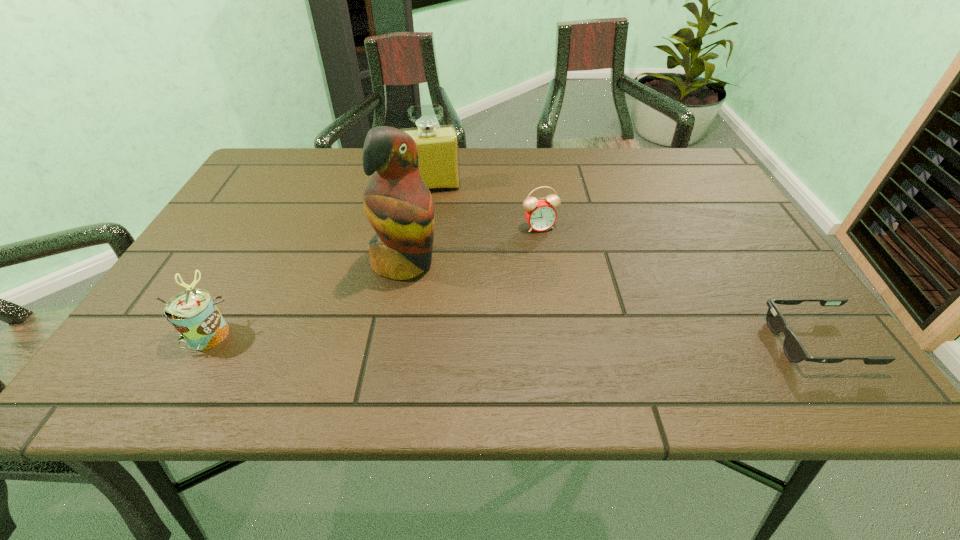
In order to click on free space on the desktop that is between the can and the rightmost object and is positioned on the front-facing side of the second tallest object in this screenshot , I will do `click(463, 337)`.

Locate an element on the screen. The width and height of the screenshot is (960, 540). free spot on the desktop that is between the can and the rightmost object and is positioned on the face of the tallest object is located at coordinates (515, 338).

Where is `free space on the desktop that is between the can and the rightmost object and is positioned on the clock face of the alarm clock`? This screenshot has height=540, width=960. free space on the desktop that is between the can and the rightmost object and is positioned on the clock face of the alarm clock is located at coordinates (593, 339).